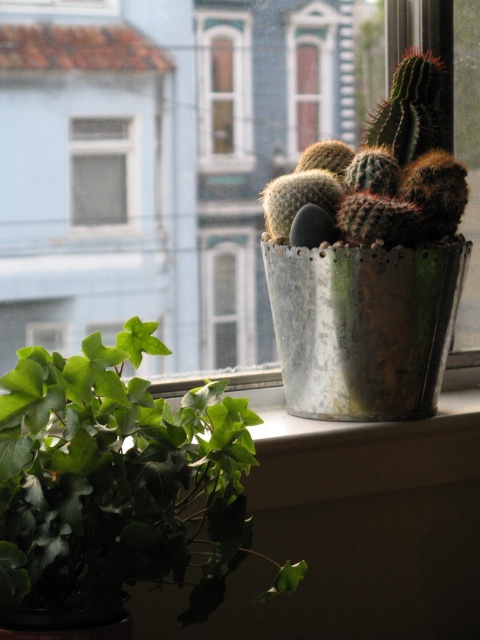
This screenshot has width=480, height=640. I want to click on green matte ivy at center, so click(113, 488).

Does point (146, 461) come closer to viewer compared to point (203, 147)?

Yes, point (146, 461) is closer to viewer.

Between point (80, 634) and point (199, 54), which one is positioned in front?

Positioned in front is point (80, 634).

At what (x,y) coordinates should I click in order to perform the action: click on green matte ivy at center. Please return your answer as a coordinate pair (x, y). This screenshot has height=640, width=480. Looking at the image, I should click on (113, 488).

Is green glass window at upper center smaller than transparent glass window at upper center?

No, green glass window at upper center is not smaller than transparent glass window at upper center.

Which is more to the left, green glass window at upper center or transparent glass window at upper center?

Positioned to the left is transparent glass window at upper center.

Is point (212, 99) positioned after point (36, 12)?

Yes, point (212, 99) is farther from viewer.

Find the location of a particular element. green glass window at upper center is located at coordinates (224, 92).

Between white glass window at upper left and transparent glass window at upper center, which one appears on the left side from the viewer's perspective?

Positioned to the left is transparent glass window at upper center.

How distant is white glass window at upper left from transparent glass window at upper center?

They are 6.74 inches apart.

Locate an element on the screen. This screenshot has width=480, height=640. white glass window at upper left is located at coordinates (101, 172).